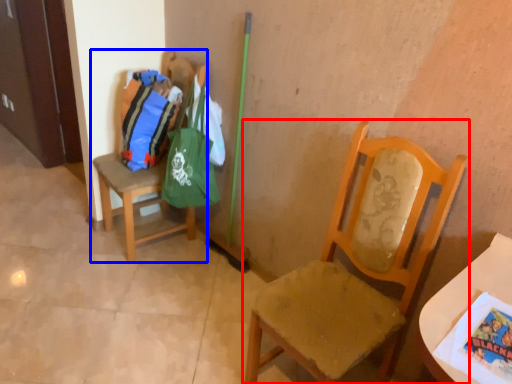
Question: Which object appears closest to the camera in this image, chair (highlighted by a red box) or chair (highlighted by a blue box)?

Choices:
 (A) chair
 (B) chair

Answer: (A)